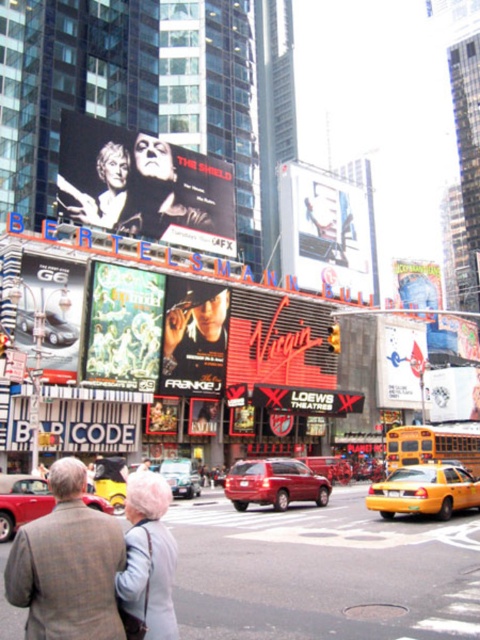
Question: Among these objects, which one is farthest from the camera?

Choices:
 (A) metallic silver sign at upper center
 (B) black glossy poster at upper center

Answer: (A)

Question: Considering the relative positions of black glossy poster at upper center and white cardboard sign at center in the image provided, where is black glossy poster at upper center located with respect to white cardboard sign at center?

Choices:
 (A) above
 (B) below

Answer: (A)

Question: Observing the image, what is the correct spatial positioning of smooth skin face at upper center in reference to white cardboard sign at center?

Choices:
 (A) above
 (B) below

Answer: (A)

Question: Which of the following is the farthest from the observer?

Choices:
 (A) (105, 330)
 (B) (73, 380)
 (C) (159, 378)

Answer: (C)

Question: Estimate the real-world distances between objects in this image. Which object is farther from the yellow rubber taxi at center?

Choices:
 (A) metallic silver suv at center
 (B) metallic red car at center

Answer: (B)

Question: Where is green matte poster at center located in relation to metallic red suv at center in the image?

Choices:
 (A) right
 (B) left

Answer: (B)